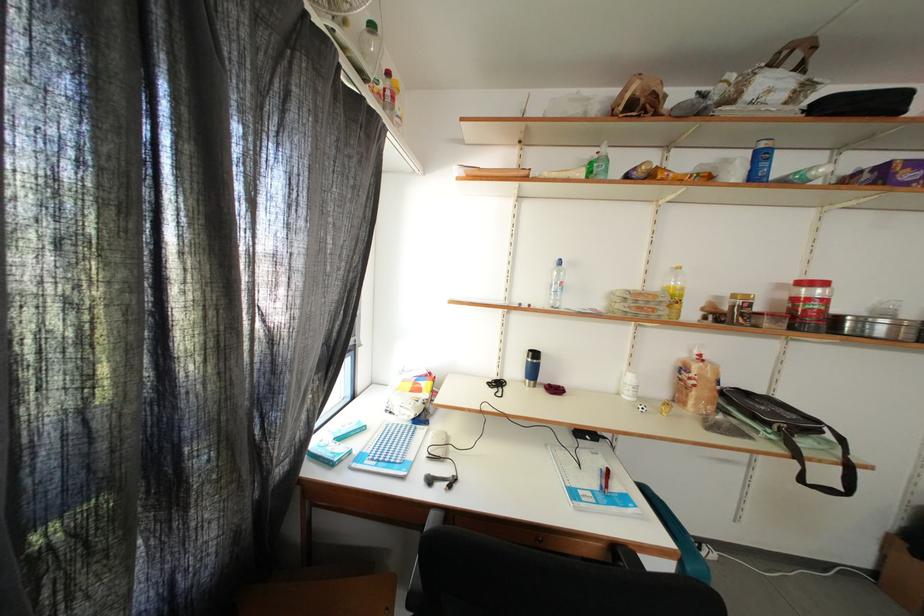
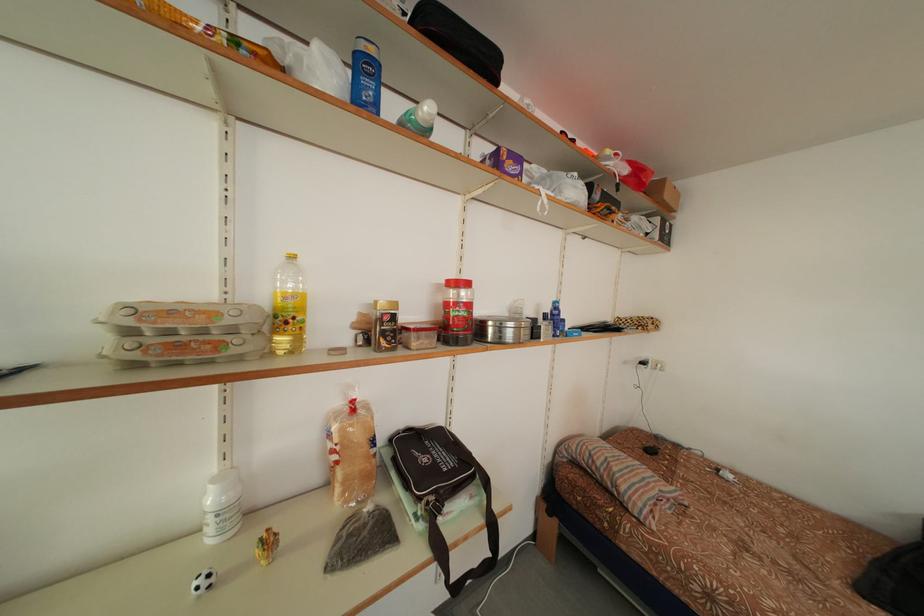
Where in the second image is the point corresponding to pixel 782 442 from the first image?

(429, 531)